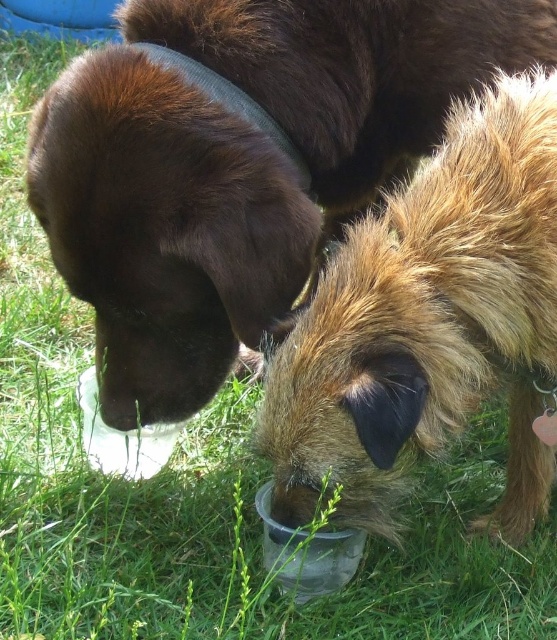
Question: Is brown matte fur at center smaller than fuzzy brown fur at lower center?

Choices:
 (A) yes
 (B) no

Answer: (B)

Question: Can you confirm if brown matte fur at center is positioned below fuzzy brown fur at lower center?

Choices:
 (A) yes
 (B) no

Answer: (B)

Question: Which object is farther from the camera taking this photo?

Choices:
 (A) brown matte fur at center
 (B) fuzzy brown fur at lower center

Answer: (A)

Question: Is brown matte fur at center thinner than fuzzy brown fur at lower center?

Choices:
 (A) no
 (B) yes

Answer: (A)